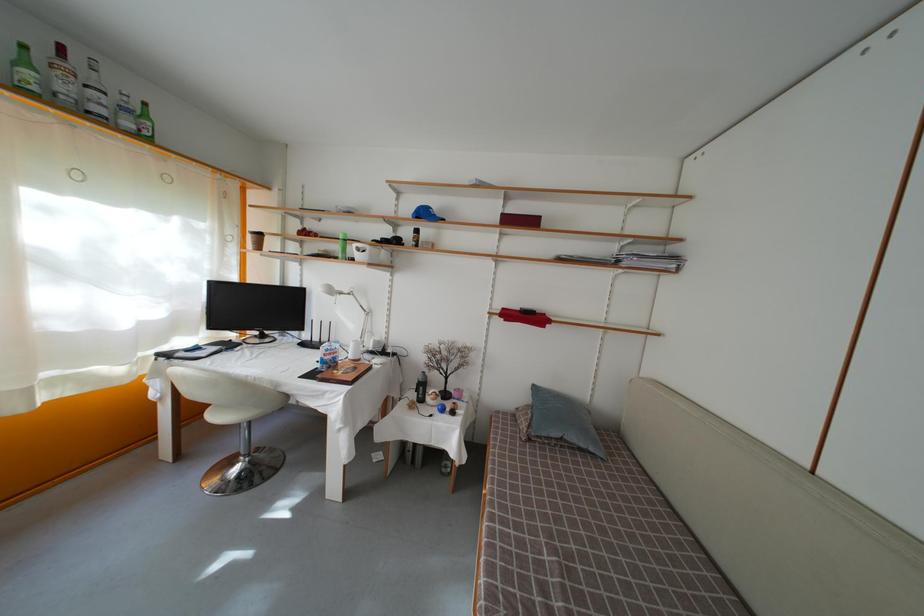
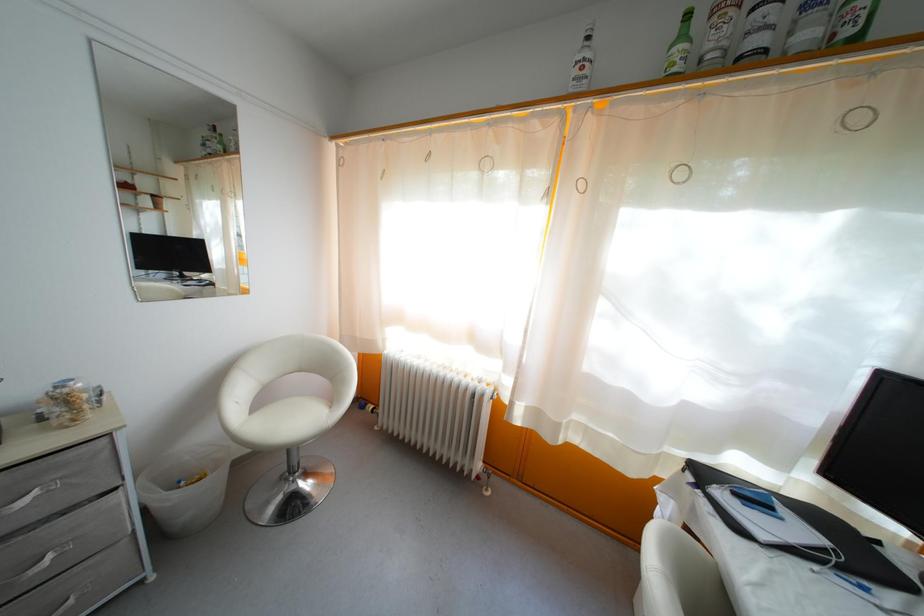
Where in the second image is the point corresponding to (x=31, y=69) from the first image?

(688, 43)